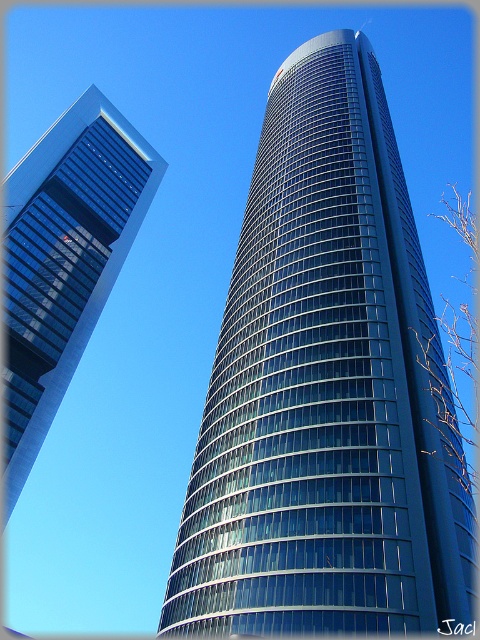
Question: Is glassy blue skyscraper at center thinner than glassy blue skyscraper at left?

Choices:
 (A) yes
 (B) no

Answer: (B)

Question: Among these points, which one is farthest from the camera?

Choices:
 (A) (213, 413)
 (B) (104, 237)

Answer: (B)

Question: Which point is closer to the camera?

Choices:
 (A) glassy blue skyscraper at left
 (B) glassy blue skyscraper at center

Answer: (B)

Question: Does glassy blue skyscraper at center appear on the right side of glassy blue skyscraper at left?

Choices:
 (A) yes
 (B) no

Answer: (A)

Question: Which point appears closest to the camera in this image?

Choices:
 (A) (81, 294)
 (B) (192, 611)

Answer: (B)

Question: Is glassy blue skyscraper at center smaller than glassy blue skyscraper at left?

Choices:
 (A) no
 (B) yes

Answer: (A)